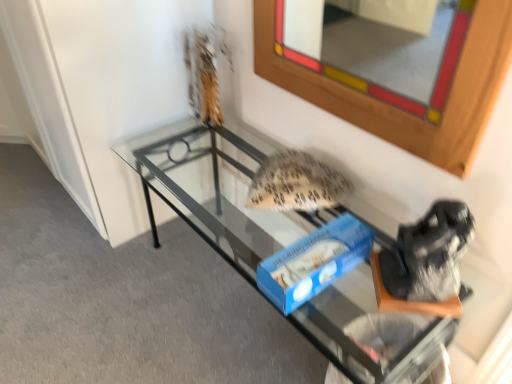
Question: Is wooden frame at upper center positioned beyond the bounds of transparent glass table at center?

Choices:
 (A) no
 (B) yes

Answer: (B)

Question: Does wooden frame at upper center have a greater width compared to transparent glass table at center?

Choices:
 (A) yes
 (B) no

Answer: (B)

Question: Is wooden frame at upper center at the right side of transparent glass table at center?

Choices:
 (A) yes
 (B) no

Answer: (A)

Question: From a real-world perspective, is wooden frame at upper center physically below transparent glass table at center?

Choices:
 (A) yes
 (B) no

Answer: (B)

Question: From a real-world perspective, is wooden frame at upper center over transparent glass table at center?

Choices:
 (A) no
 (B) yes

Answer: (B)

Question: Does wooden frame at upper center have a larger size compared to transparent glass table at center?

Choices:
 (A) yes
 (B) no

Answer: (B)

Question: Is transparent glass table at center smaller than wooden frame at upper center?

Choices:
 (A) no
 (B) yes

Answer: (A)

Question: From a real-world perspective, does transparent glass table at center sit lower than wooden frame at upper center?

Choices:
 (A) yes
 (B) no

Answer: (A)

Question: From the image's perspective, is transparent glass table at center located above wooden frame at upper center?

Choices:
 (A) no
 (B) yes

Answer: (A)

Question: Can you confirm if transparent glass table at center is shorter than wooden frame at upper center?

Choices:
 (A) no
 (B) yes

Answer: (B)

Question: Are transparent glass table at center and wooden frame at upper center located far from each other?

Choices:
 (A) no
 (B) yes

Answer: (B)

Question: Could you tell me if transparent glass table at center is facing wooden frame at upper center?

Choices:
 (A) yes
 (B) no

Answer: (B)

Question: Is transparent glass table at center to the left or to the right of wooden frame at upper center in the image?

Choices:
 (A) left
 (B) right

Answer: (A)